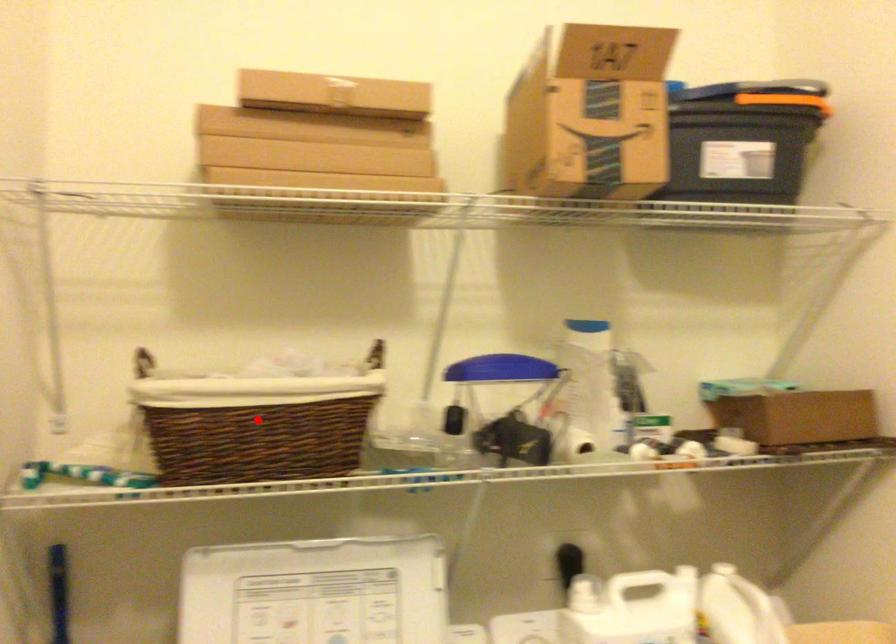
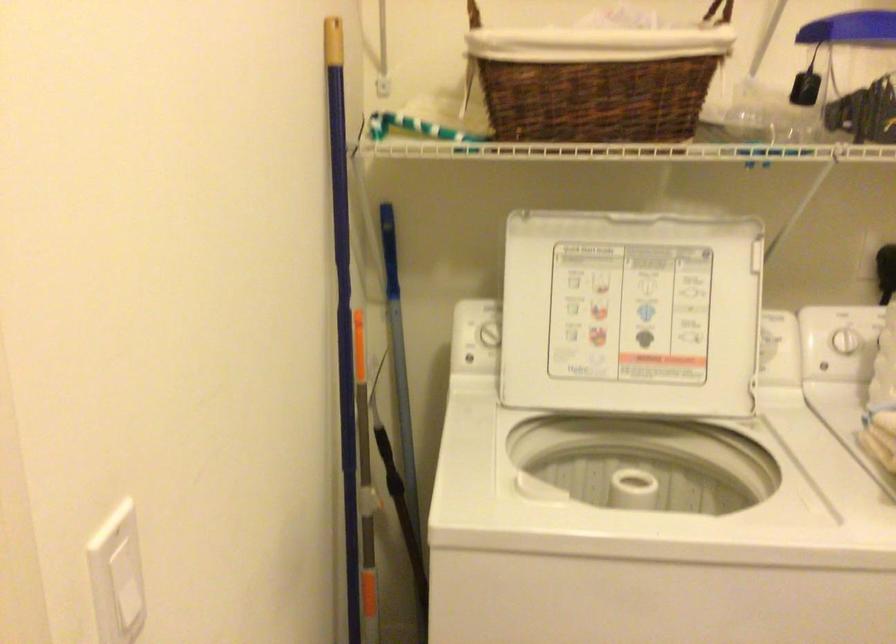
Where in the second image is the point corresponding to the highlighted location from the first image?

(597, 79)